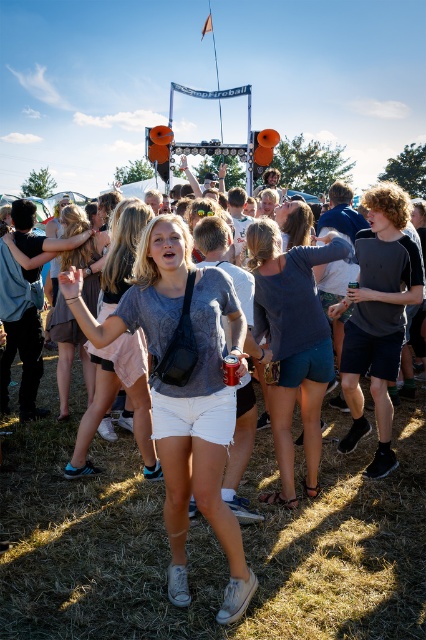
Who is taller, gray cotton t-shirt at center or dark blue denim shorts at center?

gray cotton t-shirt at center is taller.

How distant is gray cotton t-shirt at center from dark blue denim shorts at center?

gray cotton t-shirt at center is 4.01 feet from dark blue denim shorts at center.

Which is behind, point (192, 387) or point (301, 355)?

Point (301, 355)

This screenshot has width=426, height=640. What are the coordinates of `gray cotton t-shirt at center` in the screenshot? It's located at [x=203, y=442].

Does gray cotton t-shirt at center have a lesser width compared to dark gray cotton t-shirt at right?

Incorrect, gray cotton t-shirt at center's width is not less than dark gray cotton t-shirt at right's.

Find the location of a particular element. The width and height of the screenshot is (426, 640). gray cotton t-shirt at center is located at coordinates (203, 442).

Is point (229, 600) positioned in front of point (385, 403)?

Yes, point (229, 600) is closer to viewer.

Image resolution: width=426 pixels, height=640 pixels. Identify the location of gray cotton t-shirt at center. (203, 442).

Between gray fabric speaker at center and dark blue denim shorts at center, which one has less height?

Standing shorter between the two is gray fabric speaker at center.

Is point (94, 556) farther from viewer compared to point (299, 312)?

That is False.

Who is more forward, (x=322, y=547) or (x=282, y=385)?

Positioned in front is point (x=322, y=547).

Where is `gray fabric speaker at center`? This screenshot has height=640, width=426. gray fabric speaker at center is located at coordinates (207, 540).